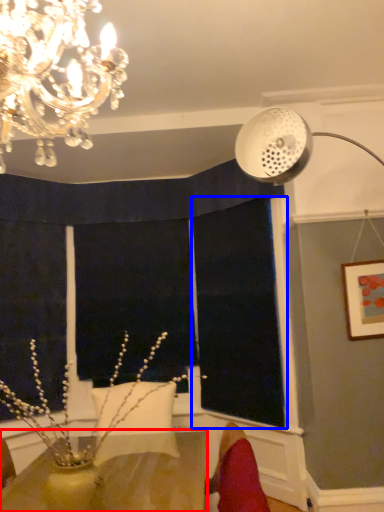
Question: Which of the following is the closest to the observer, table (highlighted by a red box) or window screen (highlighted by a blue box)?

Choices:
 (A) table
 (B) window screen

Answer: (A)